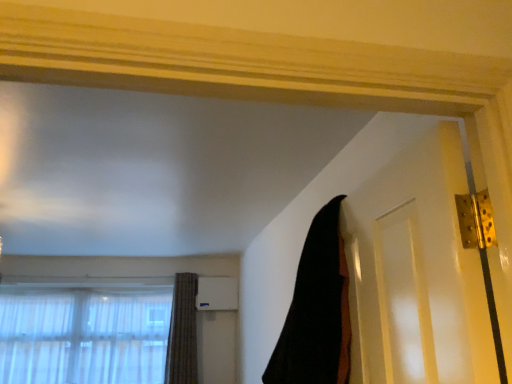
Question: Does textured brown curtain at lower left, the first curtain when ordered from bottom to top, have a greater height compared to translucent fabric at lower left?

Choices:
 (A) no
 (B) yes

Answer: (B)

Question: From the image's perspective, is textured brown curtain at lower left, the first curtain when ordered from bottom to top, above translucent fabric at lower left?

Choices:
 (A) yes
 (B) no

Answer: (A)

Question: From a real-world perspective, is textured brown curtain at lower left, the 2th curtain viewed from the right, located beneath translucent fabric at lower left?

Choices:
 (A) yes
 (B) no

Answer: (B)

Question: Is textured brown curtain at lower left, which ranks as the second curtain in top-to-bottom order, beside translucent fabric at lower left?

Choices:
 (A) no
 (B) yes

Answer: (A)

Question: Considering the relative sizes of textured brown curtain at lower left, the first curtain when ordered from bottom to top, and translucent fabric at lower left in the image provided, is textured brown curtain at lower left, the first curtain when ordered from bottom to top, shorter than translucent fabric at lower left?

Choices:
 (A) yes
 (B) no

Answer: (B)

Question: Are textured brown curtain at lower left, the second curtain from the front, and translucent fabric at lower left located far from each other?

Choices:
 (A) yes
 (B) no

Answer: (B)

Question: Is translucent fabric at lower left oriented towards textured brown curtain at lower left, the first curtain when ordered from bottom to top?

Choices:
 (A) no
 (B) yes

Answer: (A)

Question: From the image's perspective, would you say translucent fabric at lower left is positioned over textured brown curtain at lower left, arranged as the 1th curtain when viewed from the left?

Choices:
 (A) no
 (B) yes

Answer: (A)

Question: Can you confirm if translucent fabric at lower left is wider than textured brown curtain at lower left, which appears as the first curtain when viewed from the back?

Choices:
 (A) no
 (B) yes

Answer: (A)

Question: From a real-world perspective, is translucent fabric at lower left physically above textured brown curtain at lower left, which appears as the first curtain when viewed from the back?

Choices:
 (A) no
 (B) yes

Answer: (A)

Question: Is translucent fabric at lower left further to camera compared to textured brown curtain at lower left, the second curtain from the front?

Choices:
 (A) yes
 (B) no

Answer: (B)

Question: Can you confirm if translucent fabric at lower left is thinner than textured brown curtain at lower left, the second curtain from the front?

Choices:
 (A) no
 (B) yes

Answer: (B)

Question: From the image's perspective, is textured brown curtain at lower left, the first curtain when ordered from bottom to top, on black fabric at upper right, the 1th curtain from the front?

Choices:
 (A) no
 (B) yes

Answer: (A)